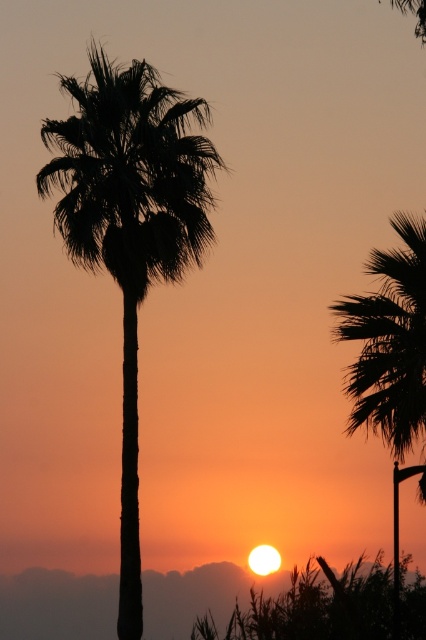
Is silhouette leafy palm at center below silhouette leafy palm at right?

No, silhouette leafy palm at center is not below silhouette leafy palm at right.

At what (x,y) coordinates should I click in order to perform the action: click on silhouette leafy palm at center. Please return your answer as a coordinate pair (x, y). This screenshot has height=640, width=426. Looking at the image, I should click on tap(129, 227).